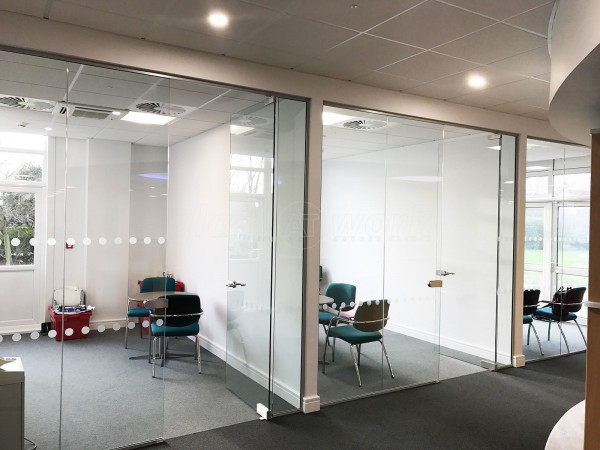
You are a GUI agent. You are given a task and a screenshot of the screen. Output one action in this format:
    pyautogui.click(x=<x>, y=<y>)
    Task: Click on the chair
    The width and height of the screenshot is (600, 450).
    Given the screenshot: What is the action you would take?
    pyautogui.click(x=181, y=315), pyautogui.click(x=155, y=280), pyautogui.click(x=378, y=315), pyautogui.click(x=342, y=293), pyautogui.click(x=566, y=302), pyautogui.click(x=531, y=300)